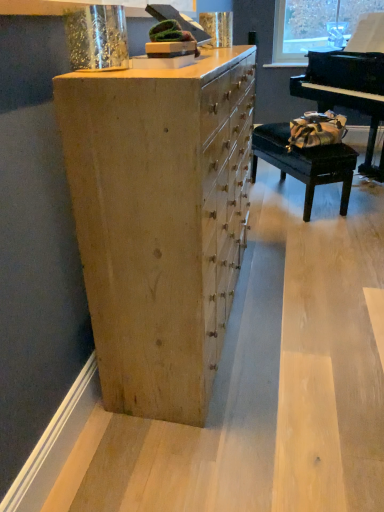
Question: Is black leather table at right outside black polished piano at right?

Choices:
 (A) no
 (B) yes

Answer: (B)

Question: From a real-world perspective, is black leather table at right located beneath black polished piano at right?

Choices:
 (A) no
 (B) yes

Answer: (B)

Question: Considering the relative sizes of black leather table at right and black polished piano at right in the image provided, is black leather table at right taller than black polished piano at right?

Choices:
 (A) yes
 (B) no

Answer: (B)

Question: Can you confirm if black leather table at right is bigger than black polished piano at right?

Choices:
 (A) yes
 (B) no

Answer: (B)

Question: Is black leather table at right turned away from black polished piano at right?

Choices:
 (A) no
 (B) yes

Answer: (A)

Question: From the image's perspective, is black polished piano at right positioned above or below natural wood chest of drawers at center?

Choices:
 (A) below
 (B) above

Answer: (B)

Question: From their relative heights in the image, would you say black polished piano at right is taller or shorter than natural wood chest of drawers at center?

Choices:
 (A) short
 (B) tall

Answer: (B)

Question: Is black polished piano at right in front of or behind natural wood chest of drawers at center in the image?

Choices:
 (A) behind
 (B) front

Answer: (A)

Question: Is black polished piano at right wider or thinner than natural wood chest of drawers at center?

Choices:
 (A) wide
 (B) thin

Answer: (A)

Question: Is black leather table at right in front of or behind black polished piano at right in the image?

Choices:
 (A) front
 (B) behind

Answer: (B)

Question: Is black leather table at right spatially inside black polished piano at right, or outside of it?

Choices:
 (A) outside
 (B) inside

Answer: (A)

Question: From the image's perspective, is black leather table at right above or below black polished piano at right?

Choices:
 (A) above
 (B) below

Answer: (B)

Question: Is point (317, 151) positioned closer to the camera than point (354, 67)?

Choices:
 (A) closer
 (B) farther

Answer: (A)

Question: Is black leather table at right spatially inside natural wood chest of drawers at center, or outside of it?

Choices:
 (A) outside
 (B) inside

Answer: (A)

Question: Is black leather table at right wider or thinner than natural wood chest of drawers at center?

Choices:
 (A) wide
 (B) thin

Answer: (B)